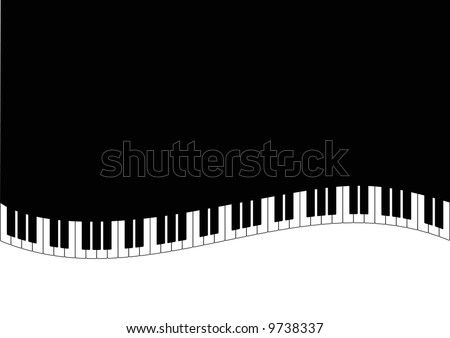
Find the location of `space under keyboard`. space under keyboard is located at coordinates (297, 257).